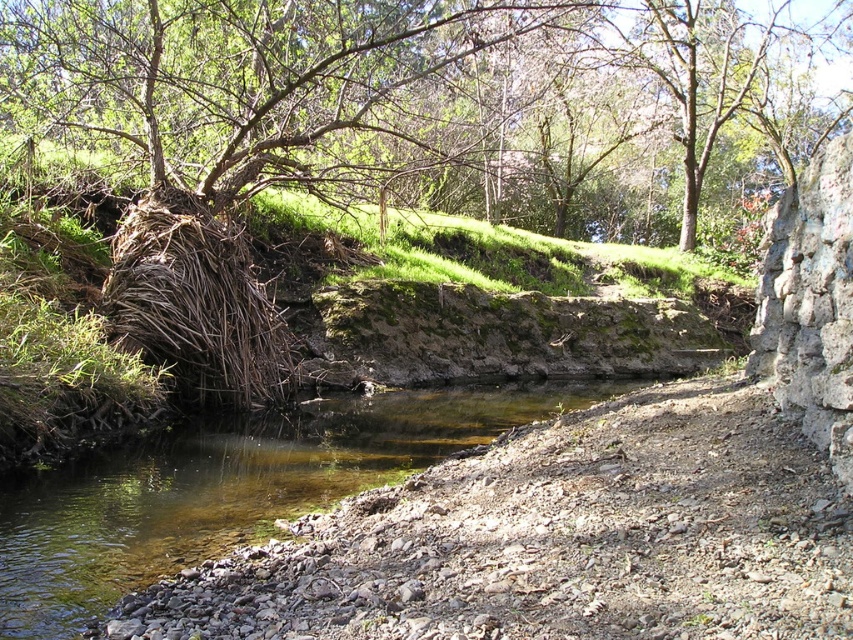
Where is `green leafy tree at upper left`? This screenshot has width=853, height=640. green leafy tree at upper left is located at coordinates (399, 88).

Can you confirm if green leafy tree at upper left is positioned to the left of clear water at bottom left?

Incorrect, green leafy tree at upper left is not on the left side of clear water at bottom left.

Locate an element on the screen. Image resolution: width=853 pixels, height=640 pixels. green leafy tree at upper left is located at coordinates (399, 88).